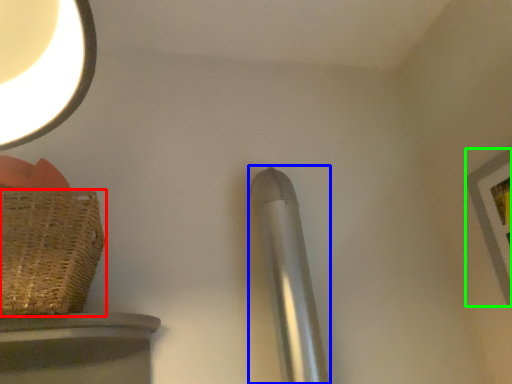
Question: Which object is positioned closest to basket (highlighted by a red box)? Select from steel (highlighted by a blue box) and picture frame (highlighted by a green box).

Choices:
 (A) steel
 (B) picture frame

Answer: (A)